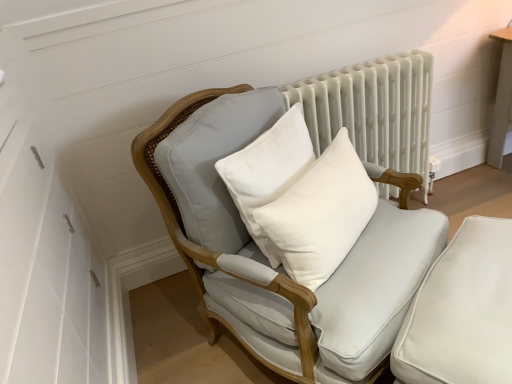
Question: Are white cotton pillow at center, which is the 1th pillow from right to left, and white fabric chair at center beside each other?

Choices:
 (A) no
 (B) yes

Answer: (A)

Question: Does white cotton pillow at center, which is the second pillow in left-to-right order, have a larger size compared to white fabric chair at center?

Choices:
 (A) yes
 (B) no

Answer: (B)

Question: Considering the relative positions of white cotton pillow at center, which is the second pillow in left-to-right order, and white fabric chair at center in the image provided, is white cotton pillow at center, which is the second pillow in left-to-right order, to the right of white fabric chair at center from the viewer's perspective?

Choices:
 (A) yes
 (B) no

Answer: (A)

Question: Does white cotton pillow at center, which is the 1th pillow from right to left, appear on the left side of white fabric chair at center?

Choices:
 (A) no
 (B) yes

Answer: (A)

Question: Can you confirm if white cotton pillow at center, which is the 1th pillow from right to left, is smaller than white fabric chair at center?

Choices:
 (A) no
 (B) yes

Answer: (B)

Question: Is white cotton pillow at center, which is the 1th pillow from right to left, bigger or smaller than white fabric chair at center?

Choices:
 (A) small
 (B) big

Answer: (A)

Question: Would you say white cotton pillow at center, which is the second pillow in left-to-right order, is inside or outside white fabric chair at center?

Choices:
 (A) outside
 (B) inside

Answer: (B)

Question: From a real-world perspective, is white cotton pillow at center, which is the 1th pillow from right to left, physically located above or below white fabric chair at center?

Choices:
 (A) above
 (B) below

Answer: (A)

Question: Considering the positions of white cotton pillow at center, which is the second pillow in left-to-right order, and white fabric chair at center in the image, is white cotton pillow at center, which is the second pillow in left-to-right order, taller or shorter than white fabric chair at center?

Choices:
 (A) short
 (B) tall

Answer: (A)

Question: From the image's perspective, is white fabric chair at center located above or below white cotton pillow at center, which is the 1th pillow from right to left?

Choices:
 (A) above
 (B) below

Answer: (B)

Question: Choose the correct answer: Is white fabric chair at center inside white cotton pillow at center, which is the second pillow in left-to-right order, or outside it?

Choices:
 (A) outside
 (B) inside

Answer: (A)

Question: From a real-world perspective, is white fabric chair at center physically located above or below white cotton pillow at center, which is the second pillow in left-to-right order?

Choices:
 (A) above
 (B) below

Answer: (B)

Question: In terms of width, does white fabric chair at center look wider or thinner when compared to white cotton pillow at center, which is the 1th pillow from right to left?

Choices:
 (A) thin
 (B) wide

Answer: (B)

Question: Considering the relative positions of white painted radiator at upper center and white fabric chair at center in the image provided, is white painted radiator at upper center to the left or to the right of white fabric chair at center?

Choices:
 (A) right
 (B) left

Answer: (A)

Question: Looking at the image, does white painted radiator at upper center seem bigger or smaller compared to white fabric chair at center?

Choices:
 (A) big
 (B) small

Answer: (B)